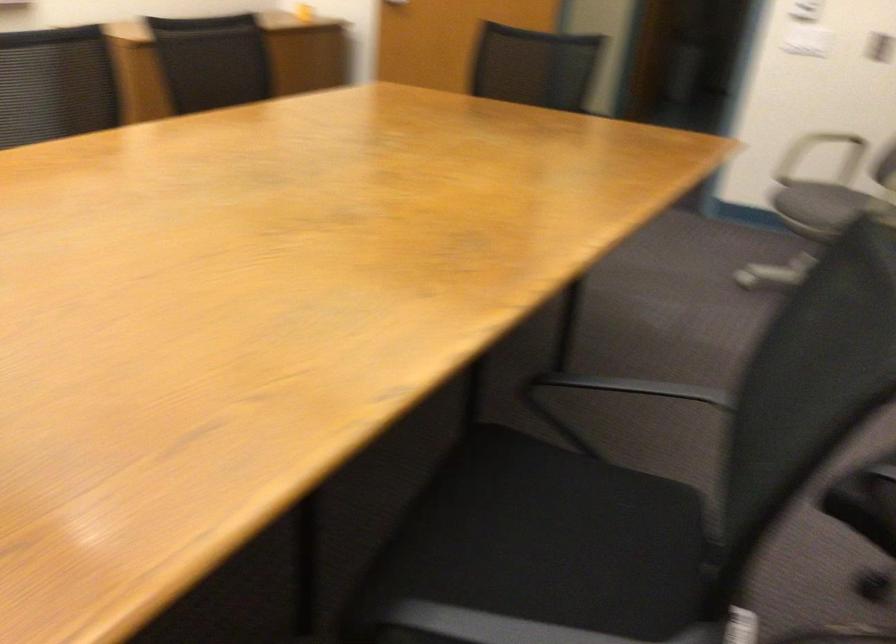
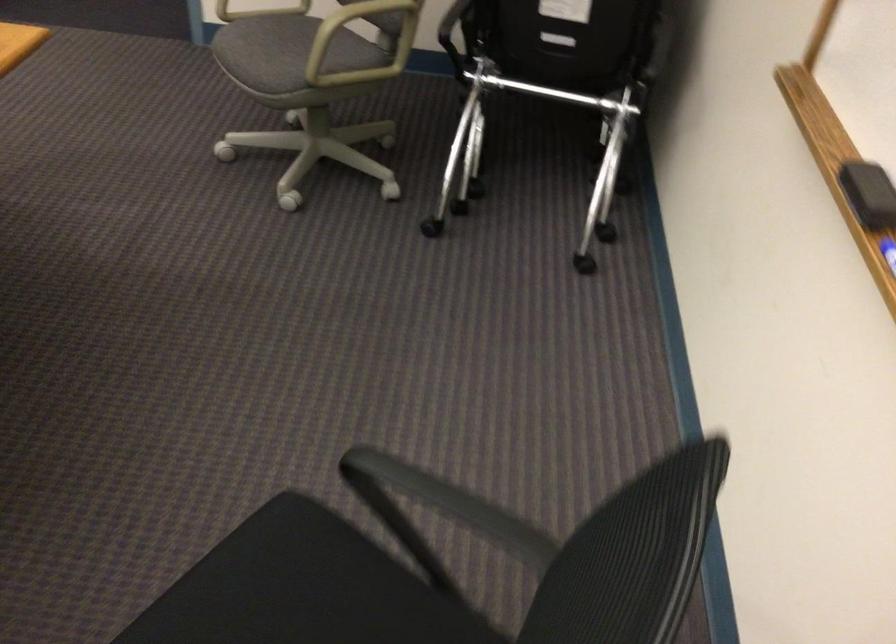
How did the camera likely rotate?

The camera's rotation is toward right-down.